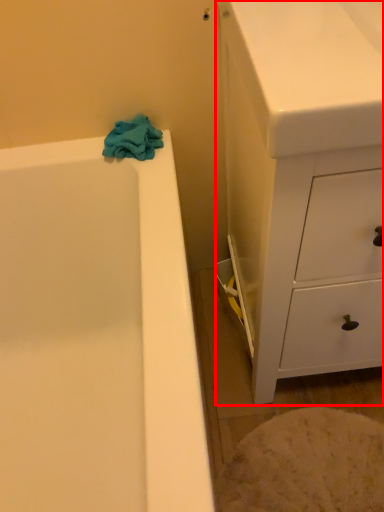
Question: From the image's perspective, where is chest of drawers (annotated by the red box) located in relation to bath towel in the image?

Choices:
 (A) below
 (B) above

Answer: (A)